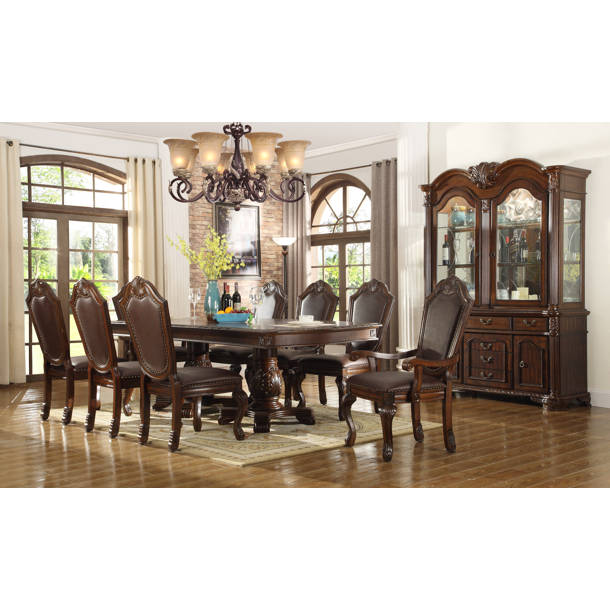
Where is `chairs`? This screenshot has width=610, height=610. chairs is located at coordinates tap(40, 318), tap(140, 329), tap(96, 313), tap(117, 303), tap(276, 300), tap(324, 302), tap(373, 303), tap(446, 325).